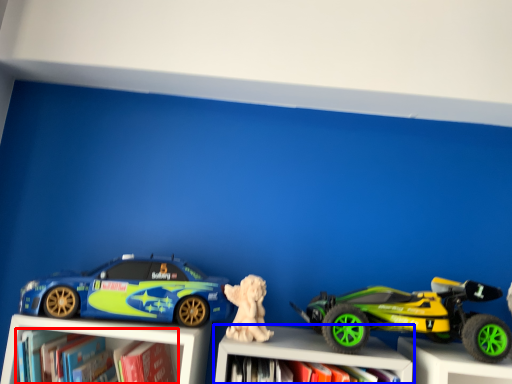
Question: Which of the following is the closest to the observer, book (highlighted by a red box) or bookcase (highlighted by a blue box)?

Choices:
 (A) book
 (B) bookcase

Answer: (A)